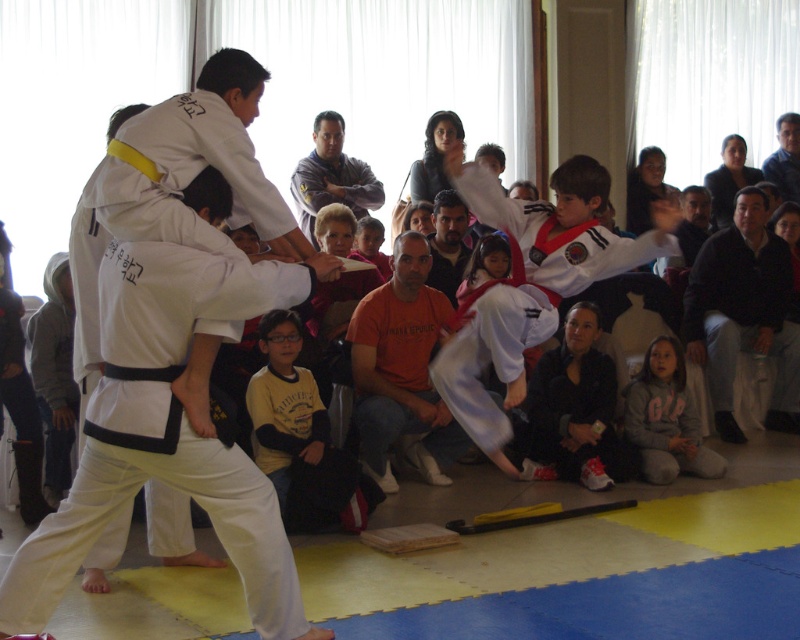
You are a photographer standing at the camera position. You want to take a closeup photo of the black cotton shirt at upper right. Given that your camera can focus on objects within 5 meters, will you be able to capture a clear closeup?

The black cotton shirt at upper right is 6.98 meters from the camera, which is beyond the 5 meter focus range. Therefore, the camera cannot capture a clear closeup of the black cotton shirt at upper right.

You are standing at the center of the gymnasium and need to locate the black cotton shirt at upper right. Based on the coordinates provided, in which direction should you look to find it?

The black cotton shirt at upper right is located at coordinates point (744, 314), which means it is positioned near the top right corner of the image. Therefore, you should look upward and to the right to locate it.